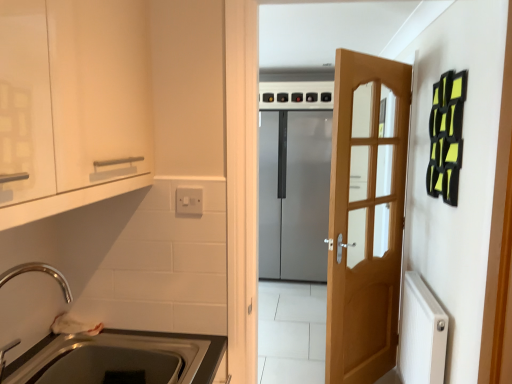
Question: Is white glossy cabinet at upper left not close to metallic stainless steel sink at lower left?

Choices:
 (A) no
 (B) yes

Answer: (A)

Question: Is white glossy cabinet at upper left behind metallic stainless steel sink at lower left?

Choices:
 (A) yes
 (B) no

Answer: (B)

Question: From the image's perspective, would you say white glossy cabinet at upper left is positioned over metallic stainless steel sink at lower left?

Choices:
 (A) no
 (B) yes

Answer: (B)

Question: Considering the relative sizes of white glossy cabinet at upper left and metallic stainless steel sink at lower left in the image provided, is white glossy cabinet at upper left smaller than metallic stainless steel sink at lower left?

Choices:
 (A) yes
 (B) no

Answer: (B)

Question: Considering the relative positions of white glossy cabinet at upper left and metallic stainless steel sink at lower left in the image provided, is white glossy cabinet at upper left to the right of metallic stainless steel sink at lower left from the viewer's perspective?

Choices:
 (A) yes
 (B) no

Answer: (B)

Question: Would you say white plastic switch at upper center is inside or outside metallic stainless steel sink at lower left?

Choices:
 (A) inside
 (B) outside

Answer: (B)

Question: Is white plastic switch at upper center wider or thinner than metallic stainless steel sink at lower left?

Choices:
 (A) wide
 (B) thin

Answer: (B)

Question: Relative to metallic stainless steel sink at lower left, is white plastic switch at upper center in front or behind?

Choices:
 (A) behind
 (B) front

Answer: (A)

Question: From a real-world perspective, is white plastic switch at upper center physically located above or below metallic stainless steel sink at lower left?

Choices:
 (A) below
 (B) above

Answer: (B)

Question: From the image's perspective, is wooden door at center located above or below satin silver refrigerator at center?

Choices:
 (A) above
 (B) below

Answer: (B)

Question: Does point (353, 302) appear closer or farther from the camera than point (271, 177)?

Choices:
 (A) farther
 (B) closer

Answer: (B)

Question: In terms of size, does wooden door at center appear bigger or smaller than satin silver refrigerator at center?

Choices:
 (A) small
 (B) big

Answer: (A)

Question: Based on their positions, is wooden door at center located to the left or right of satin silver refrigerator at center?

Choices:
 (A) left
 (B) right

Answer: (B)

Question: Looking at their shapes, would you say metallic stainless steel sink at lower left is wider or thinner than white plastic switch at upper center?

Choices:
 (A) wide
 (B) thin

Answer: (A)

Question: Considering their positions, is metallic stainless steel sink at lower left located in front of or behind white plastic switch at upper center?

Choices:
 (A) behind
 (B) front

Answer: (B)